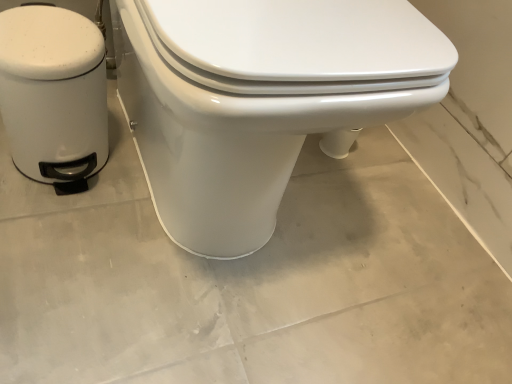
Question: Considering the relative positions of white matte trash can at left and white glossy toilet at center in the image provided, is white matte trash can at left to the left or to the right of white glossy toilet at center?

Choices:
 (A) left
 (B) right

Answer: (A)

Question: Is white matte trash can at left inside or outside of white glossy toilet at center?

Choices:
 (A) inside
 (B) outside

Answer: (B)

Question: Is point (65, 61) closer or farther from the camera than point (187, 172)?

Choices:
 (A) closer
 (B) farther

Answer: (A)

Question: Is point (211, 46) positioned closer to the camera than point (51, 33)?

Choices:
 (A) closer
 (B) farther

Answer: (A)

Question: From the image's perspective, relative to white matte trash can at left, is white glossy toilet at center above or below?

Choices:
 (A) above
 (B) below

Answer: (A)

Question: Is white glossy toilet at center in front of or behind white matte trash can at left in the image?

Choices:
 (A) front
 (B) behind

Answer: (A)

Question: Looking at the image, does white glossy toilet at center seem bigger or smaller compared to white matte trash can at left?

Choices:
 (A) small
 (B) big

Answer: (B)